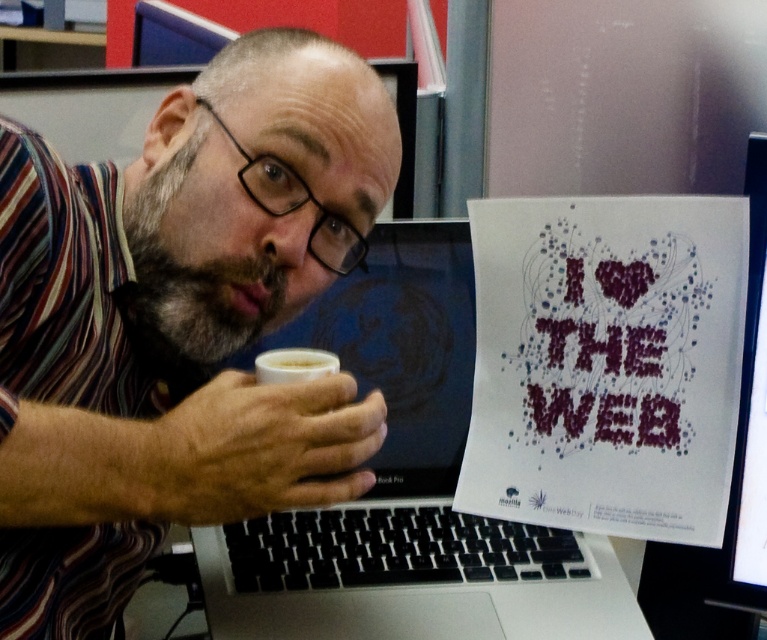
You are organizing a small event and need to place a decorative item on a table. The white paper poster at center and the white frothy beverage at lower center are available. Which item should you choose if you want something larger to catch attention?

The white paper poster at center has a larger size compared to the white frothy beverage at lower center, so it would be better to choose the white paper poster at center to catch attention.

What is the object located at the coordinates point (606, 362)?

The object located at point (606, 362) is the white paper poster at center.